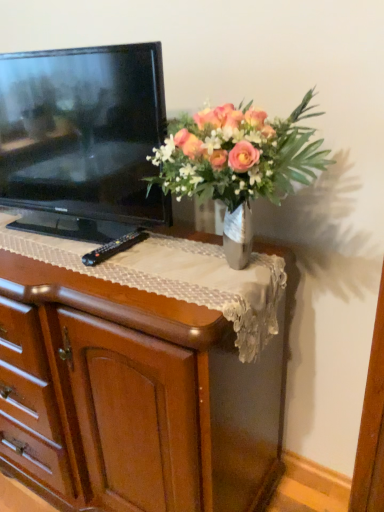
The image size is (384, 512). Describe the element at coordinates (238, 162) in the screenshot. I see `metallic vase at upper center` at that location.

What do you see at coordinates (134, 379) in the screenshot? I see `wooden chest of drawers at center` at bounding box center [134, 379].

At what (x,y) coordinates should I click in order to perform the action: click on black glossy television at left. Please return your answer as a coordinate pair (x, y). Looking at the image, I should click on (83, 139).

Is wooden chest of drawers at center bigger than metallic vase at upper center?

Indeed, wooden chest of drawers at center has a larger size compared to metallic vase at upper center.

Is metallic vase at upper center at the back of wooden chest of drawers at center?

wooden chest of drawers at center does not have its back to metallic vase at upper center.

Between wooden chest of drawers at center and metallic vase at upper center, which one has less height?

metallic vase at upper center.

Can you tell me how much wooden chest of drawers at center and metallic vase at upper center differ in facing direction?

wooden chest of drawers at center and metallic vase at upper center are facing 0.182 degrees away from each other.

Is black glossy television at left completely or partially inside metallic vase at upper center?

No.

Does metallic vase at upper center turn towards black glossy television at left?

No, metallic vase at upper center is not turned towards black glossy television at left.

From a real-world perspective, is metallic vase at upper center physically below black glossy television at left?

Yes, from a real-world perspective, metallic vase at upper center is under black glossy television at left.

Does metallic vase at upper center have a larger size compared to black glossy television at left?

Incorrect, metallic vase at upper center is not larger than black glossy television at left.

Based on the photo, choose the correct answer: Is wooden chest of drawers at center inside black plastic remote at center or outside it?

wooden chest of drawers at center lies outside black plastic remote at center.

Is wooden chest of drawers at center facing away from black plastic remote at center?

wooden chest of drawers at center is not turned away from black plastic remote at center.

Is wooden chest of drawers at center next to black plastic remote at center?

No, wooden chest of drawers at center is not touching black plastic remote at center.

From the picture: From a real-world perspective, is wooden chest of drawers at center over black plastic remote at center?

No, from a real-world perspective, wooden chest of drawers at center is not above black plastic remote at center.

Is point (11, 97) closer to camera compared to point (212, 140)?

No, it is behind (212, 140).

Is black glossy television at left aimed at metallic vase at upper center?

No, black glossy television at left is not turned towards metallic vase at upper center.

In the scene shown: Is metallic vase at upper center located within black glossy television at left?

Actually, metallic vase at upper center is outside black glossy television at left.

Considering the sizes of black glossy television at left and metallic vase at upper center in the image, is black glossy television at left bigger or smaller than metallic vase at upper center?

black glossy television at left is bigger than metallic vase at upper center.

Considering the relative positions of wooden chest of drawers at center and black glossy television at left in the image provided, is wooden chest of drawers at center to the right of black glossy television at left from the viewer's perspective?

Incorrect, wooden chest of drawers at center is not on the right side of black glossy television at left.

Can you confirm if wooden chest of drawers at center is bigger than black glossy television at left?

Indeed, wooden chest of drawers at center has a larger size compared to black glossy television at left.

What's the angular difference between wooden chest of drawers at center and black glossy television at left's facing directions?

6.45 degrees separate the facing orientations of wooden chest of drawers at center and black glossy television at left.

Is wooden chest of drawers at center not close to black glossy television at left?

No.

From the picture: Is metallic vase at upper center inside or outside of wooden chest of drawers at center?

metallic vase at upper center is located beyond the bounds of wooden chest of drawers at center.

From the image's perspective, is metallic vase at upper center above or below wooden chest of drawers at center?

Clearly, from the image's perspective, metallic vase at upper center is above wooden chest of drawers at center.

Is metallic vase at upper center wider than wooden chest of drawers at center?

No.

How different are the orientations of metallic vase at upper center and wooden chest of drawers at center in degrees?

metallic vase at upper center and wooden chest of drawers at center are facing 0.182 degrees away from each other.

Is metallic vase at upper center bigger than black plastic remote at center?

Yes, metallic vase at upper center is bigger than black plastic remote at center.

Consider the image. Considering the relative positions of metallic vase at upper center and black plastic remote at center in the image provided, is metallic vase at upper center behind black plastic remote at center?

No, the depth of metallic vase at upper center is less than that of black plastic remote at center.

Could you tell me if metallic vase at upper center is facing black plastic remote at center?

No, metallic vase at upper center is not oriented towards black plastic remote at center.

From a real-world perspective, which object stands above the other?

In real-world perspective, metallic vase at upper center is above.

Find the location of a particular element. the chest of drawers beneath the metallic vase at upper center (from a real-world perspective) is located at coordinates (134, 379).

Find the location of a particular element. television behind the metallic vase at upper center is located at coordinates (83, 139).

Considering their positions, is black plastic remote at center positioned further to wooden chest of drawers at center than black glossy television at left?

The object further to wooden chest of drawers at center is black plastic remote at center.

Considering their positions, is metallic vase at upper center positioned closer to wooden chest of drawers at center than black glossy television at left?

Among the two, black glossy television at left is located nearer to wooden chest of drawers at center.

Estimate the real-world distances between objects in this image. Which object is closer to black glossy television at left, black plastic remote at center or metallic vase at upper center?

metallic vase at upper center is positioned closer to the anchor black glossy television at left.

Estimate the real-world distances between objects in this image. Which object is closer to black glossy television at left, metallic vase at upper center or black plastic remote at center?

Among the two, metallic vase at upper center is located nearer to black glossy television at left.

Estimate the real-world distances between objects in this image. Which object is closer to metallic vase at upper center, black plastic remote at center or wooden chest of drawers at center?

wooden chest of drawers at center is closer to metallic vase at upper center.

Looking at the image, which one is located further to metallic vase at upper center, wooden chest of drawers at center or black glossy television at left?

Based on the image, wooden chest of drawers at center appears to be further to metallic vase at upper center.

From the image, which object appears to be nearer to black glossy television at left, black plastic remote at center or wooden chest of drawers at center?

black plastic remote at center lies closer to black glossy television at left than the other object.

Looking at the image, which one is located further to black plastic remote at center, black glossy television at left or metallic vase at upper center?

metallic vase at upper center is positioned further to the anchor black plastic remote at center.

At what (x,y) coordinates should I click in order to perform the action: click on remote between black glossy television at left and wooden chest of drawers at center from top to bottom. Please return your answer as a coordinate pair (x, y). The width and height of the screenshot is (384, 512). Looking at the image, I should click on click(114, 247).

The image size is (384, 512). In order to click on television situated between wooden chest of drawers at center and metallic vase at upper center from left to right in this screenshot , I will do `click(83, 139)`.

This screenshot has height=512, width=384. Find the location of `remote between black glossy television at left and metallic vase at upper center from left to right`. remote between black glossy television at left and metallic vase at upper center from left to right is located at coordinates tap(114, 247).

Identify the location of remote between wooden chest of drawers at center and metallic vase at upper center from left to right. (114, 247).